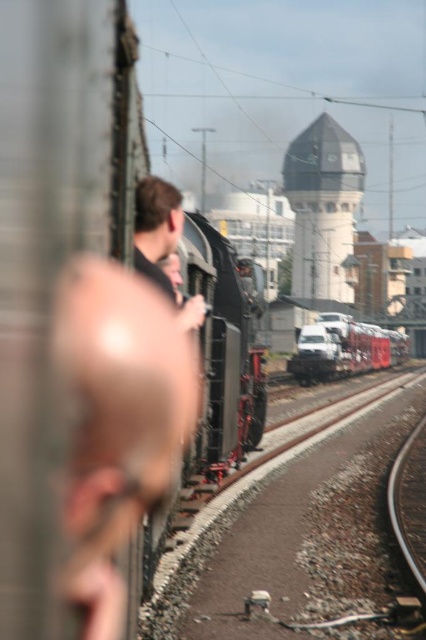
Question: Which object is closer to the camera taking this photo?

Choices:
 (A) smooth brown hair at center
 (B) white glossy truck at center

Answer: (A)

Question: Which point appears closest to the camera in this image?

Choices:
 (A) click(138, 260)
 (B) click(394, 346)

Answer: (A)

Question: Can you confirm if white glossy truck at center is bigger than smooth brown hair at center?

Choices:
 (A) yes
 (B) no

Answer: (A)

Question: Does white glossy truck at center appear on the right side of smooth brown hair at center?

Choices:
 (A) no
 (B) yes

Answer: (B)

Question: Among these objects, which one is farthest from the camera?

Choices:
 (A) white glossy truck at center
 (B) smooth brown hair at center

Answer: (A)

Question: Is white glossy truck at center positioned behind smooth brown hair at center?

Choices:
 (A) yes
 (B) no

Answer: (A)